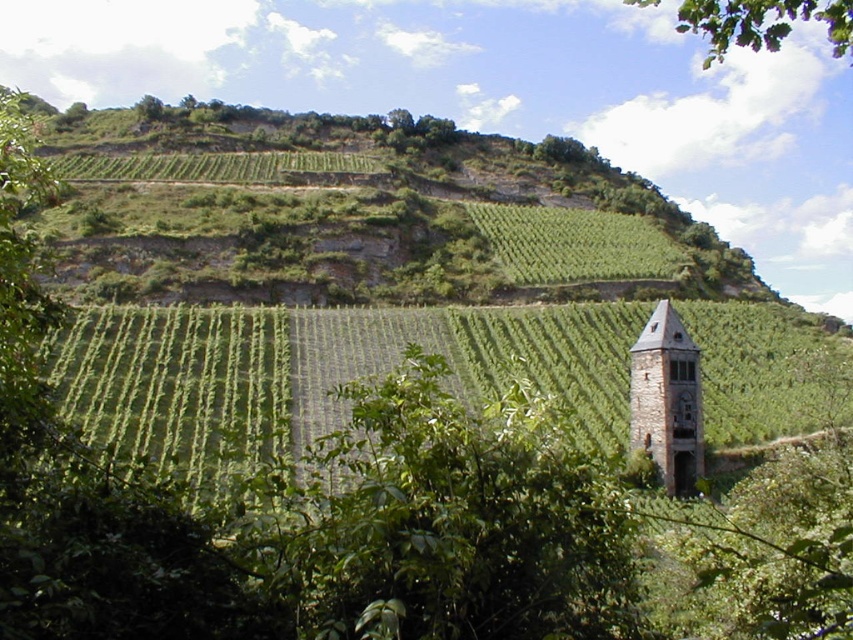
Is brown stone bell tower at right smaller than green leafy tree at upper right?

Correct, brown stone bell tower at right occupies less space than green leafy tree at upper right.

Which of these two, brown stone bell tower at right or green leafy tree at upper right, stands shorter?

With less height is brown stone bell tower at right.

Measure the distance between brown stone bell tower at right and camera.

74.82 meters

Find the location of a particular element. brown stone bell tower at right is located at coordinates (666, 400).